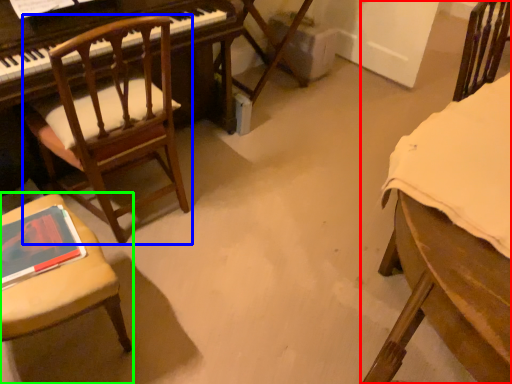
Question: Considering the real-world distances, which object is closest to chair (highlighted by a red box)? chair (highlighted by a blue box) or chair (highlighted by a green box).

Choices:
 (A) chair
 (B) chair

Answer: (B)